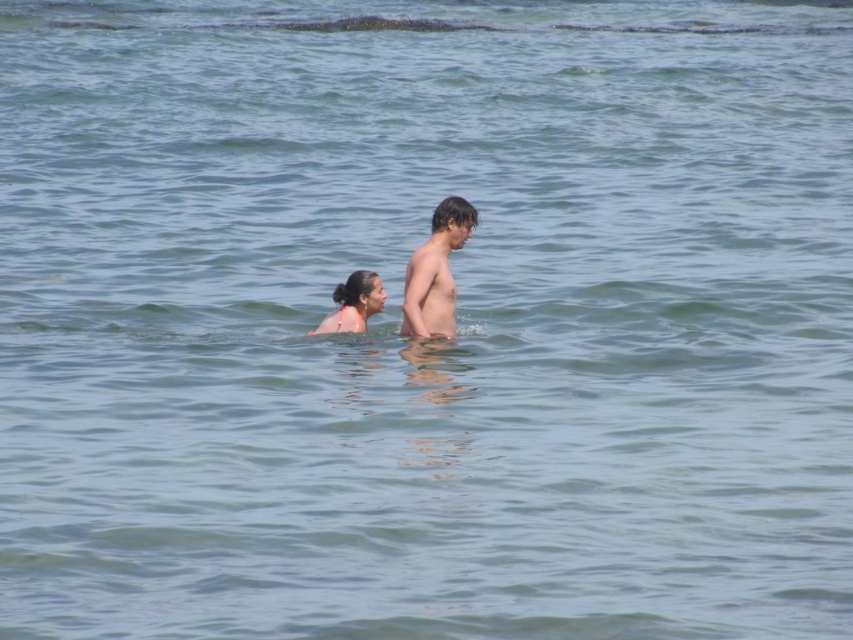
Question: Can you confirm if pink matte skin at center is positioned below pink fabric bikini at center?

Choices:
 (A) yes
 (B) no

Answer: (B)

Question: Considering the relative positions of pink matte skin at center and pink fabric bikini at center in the image provided, where is pink matte skin at center located with respect to pink fabric bikini at center?

Choices:
 (A) above
 (B) below

Answer: (A)

Question: Among these points, which one is nearest to the camera?

Choices:
 (A) (428, 305)
 (B) (410, 273)

Answer: (B)

Question: Which object is positioned closest to the pink fabric bikini at center?

Choices:
 (A) pink matte skin at center
 (B) smooth skin boy at center

Answer: (A)

Question: Can you confirm if pink matte skin at center is bigger than pink fabric bikini at center?

Choices:
 (A) yes
 (B) no

Answer: (A)

Question: Among these points, which one is farthest from the camera?

Choices:
 (A) (466, 218)
 (B) (370, 276)
 (C) (463, 237)

Answer: (B)